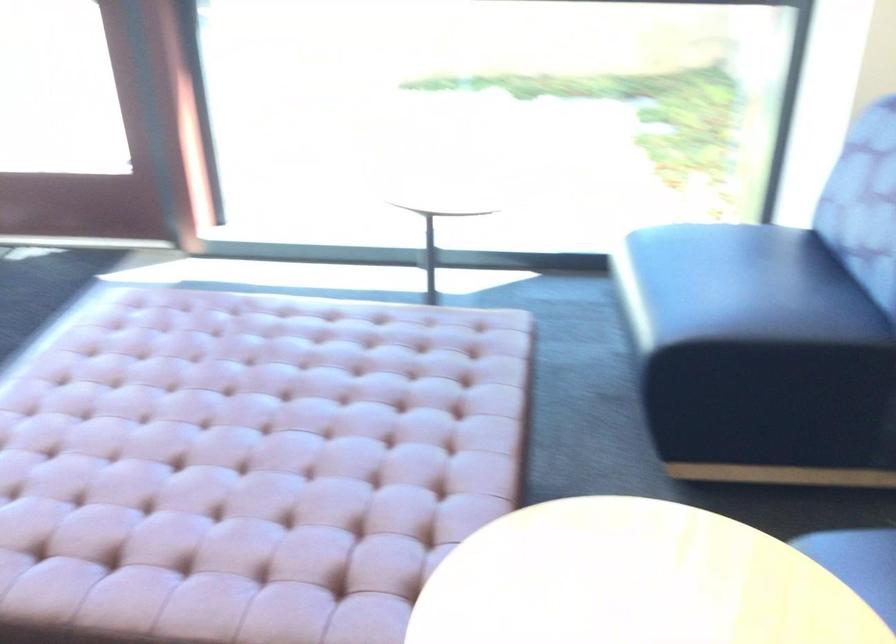
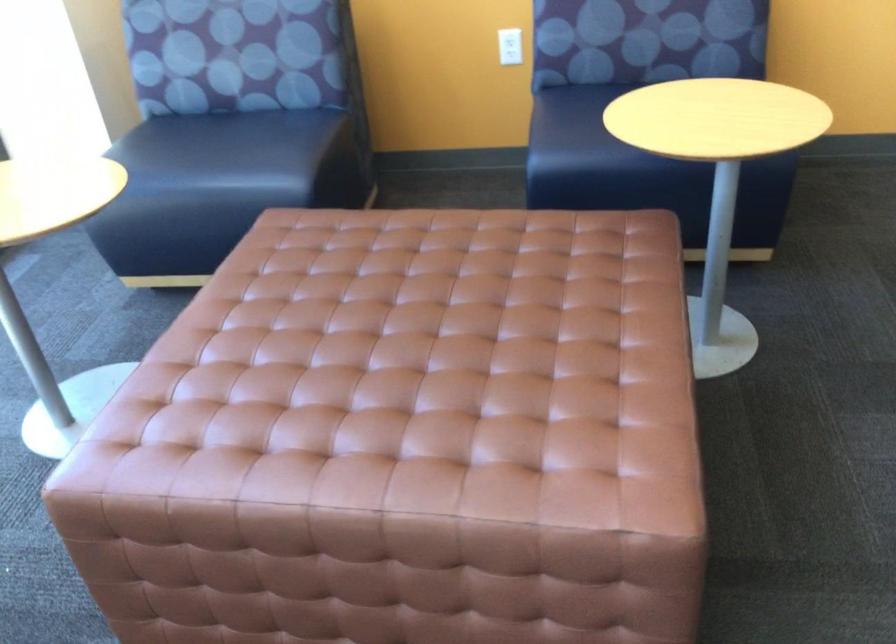
In the second image, find the point that corresponds to point 693,256 in the first image.

(199, 149)